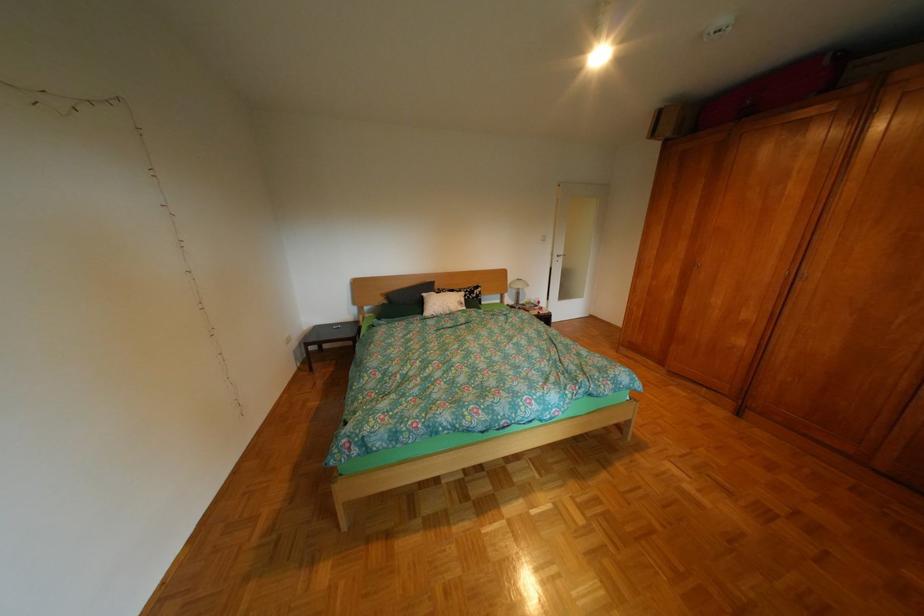
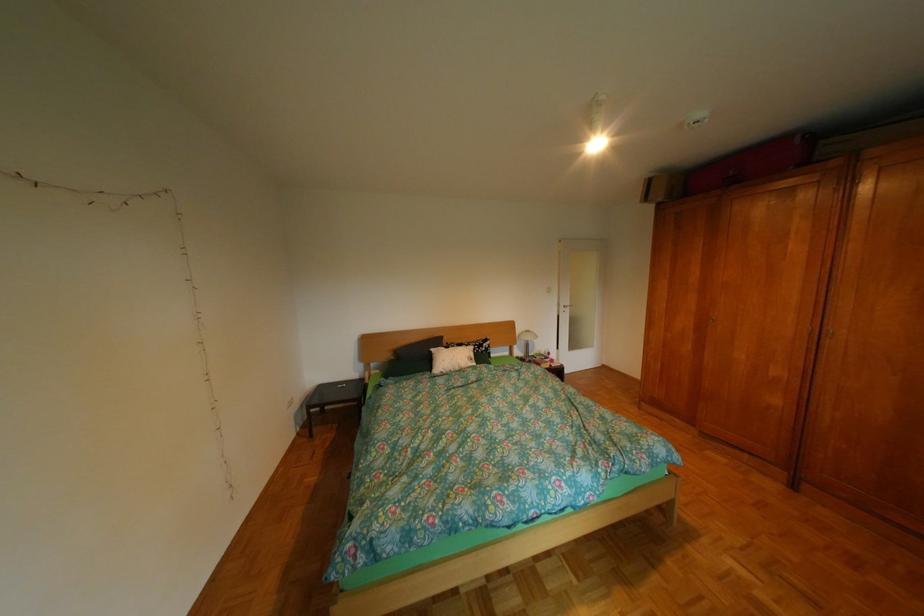
Question: How did the camera likely rotate?

Choices:
 (A) Left
 (B) Right
 (C) Up
 (D) Down

Answer: (C)